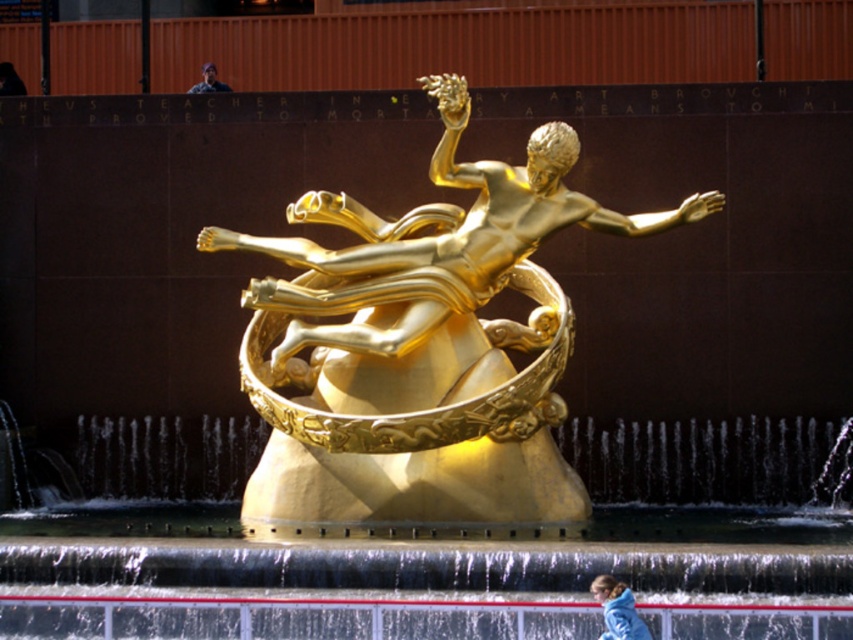
Can you confirm if blue fleece jacket at lower right is wider than dark blue fabric person at upper center?

No.

Does point (619, 621) come behind point (9, 88)?

That is False.

At what (x,y) coordinates should I click in order to perform the action: click on blue fleece jacket at lower right. Please return your answer as a coordinate pair (x, y). Looking at the image, I should click on (618, 609).

Who is more distant from viewer, [563,125] or [9,81]?

The point [9,81] is behind.

Find the location of a particular element. This screenshot has height=640, width=853. gold polished statue at center is located at coordinates (422, 337).

Measure the distance between dark blue shirt at upper center and dark blue fabric person at upper center.

dark blue shirt at upper center is 9.60 meters away from dark blue fabric person at upper center.

Between point (206, 76) and point (19, 88), which one is positioned behind?

Point (19, 88)

Identify the location of dark blue shirt at upper center. (209, 81).